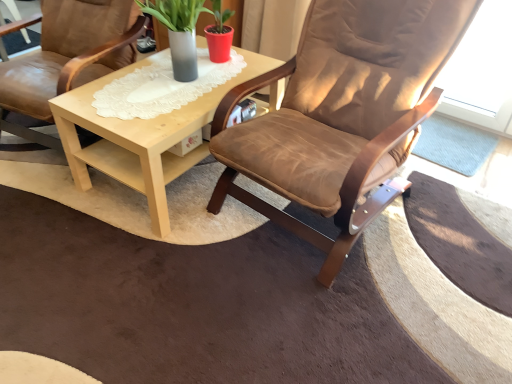
Find the location of a particular element. This screenshot has height=384, width=512. free spot to the right of brown suede chair at center, the second chair when ordered from left to right is located at coordinates (452, 214).